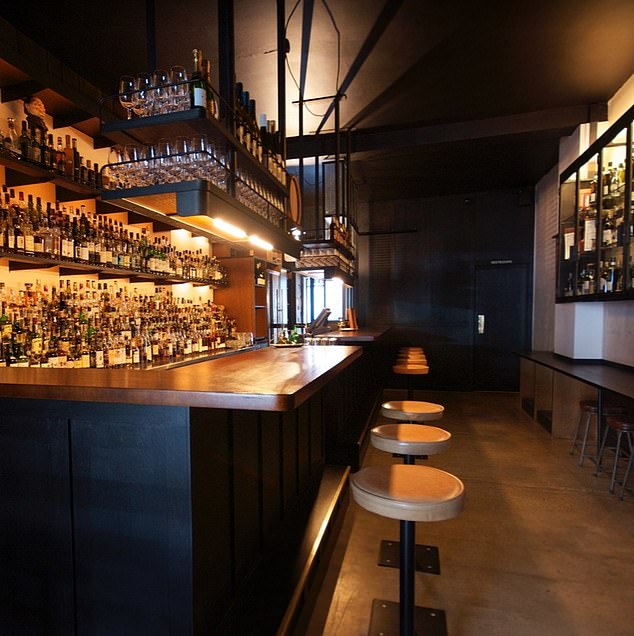
You are a GUI agent. You are given a task and a screenshot of the screen. Output one action in this format:
    pyautogui.click(x=<x>, y=<y>)
    Task: Click on the counter
    This screenshot has height=636, width=634.
    Given the screenshot: What is the action you would take?
    pyautogui.click(x=584, y=366)